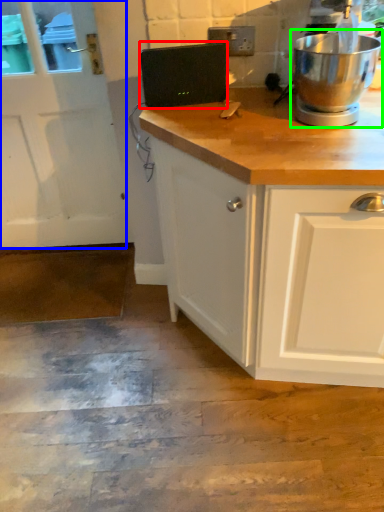
Question: Based on their relative distances, which object is nearer to appliance (highlighted by a red box)? Choose from screen door (highlighted by a blue box) and home appliance (highlighted by a green box).

Choices:
 (A) screen door
 (B) home appliance

Answer: (B)